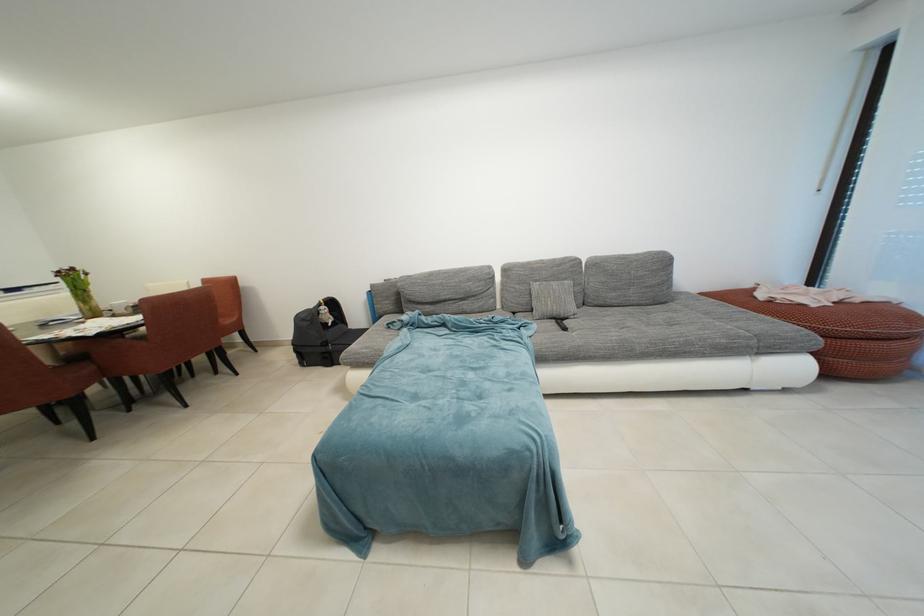
What are the coordinates of `small grey cushion` in the screenshot? It's located at (628, 278).